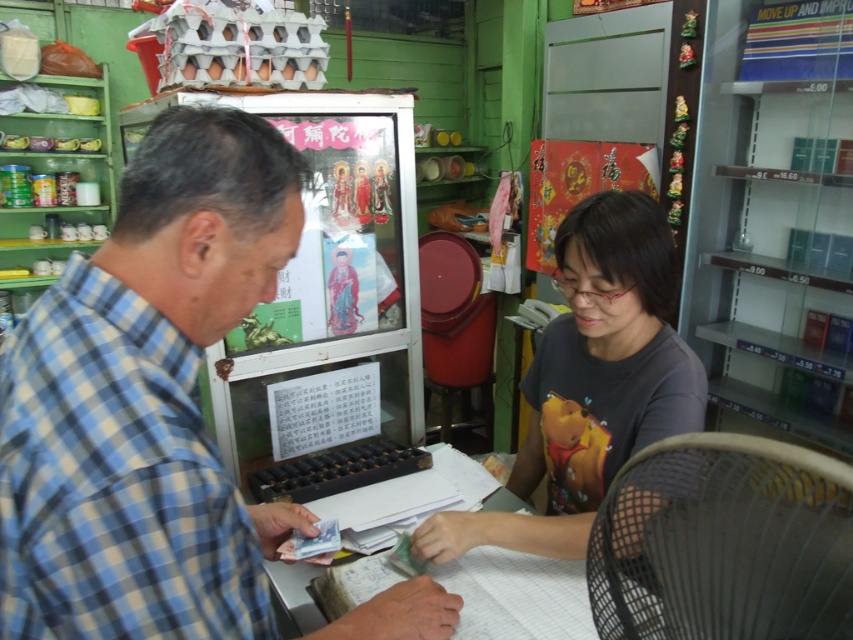
You are a customer in the shop and need to reach an item on a high shelf. The blue plaid shirt at left and the gray matte shirt at center are both employees. Which employee should you ask for help?

The blue plaid shirt at left is much taller than the gray matte shirt at center, so you should ask the blue plaid shirt at left for help because they can reach higher.

You are a delivery person who just arrived at the shop. You need to place a package on the counter between the blue plaid shirt at left and the cash register. Can you fit the package there?

The blue plaid shirt at left and the viewer are 51.42 centimeters apart. Since the package needs to be placed between the blue plaid shirt at left and the cash register, and the distance between them is 51.42 cm, the package can likely fit as long as its dimensions are within that space.